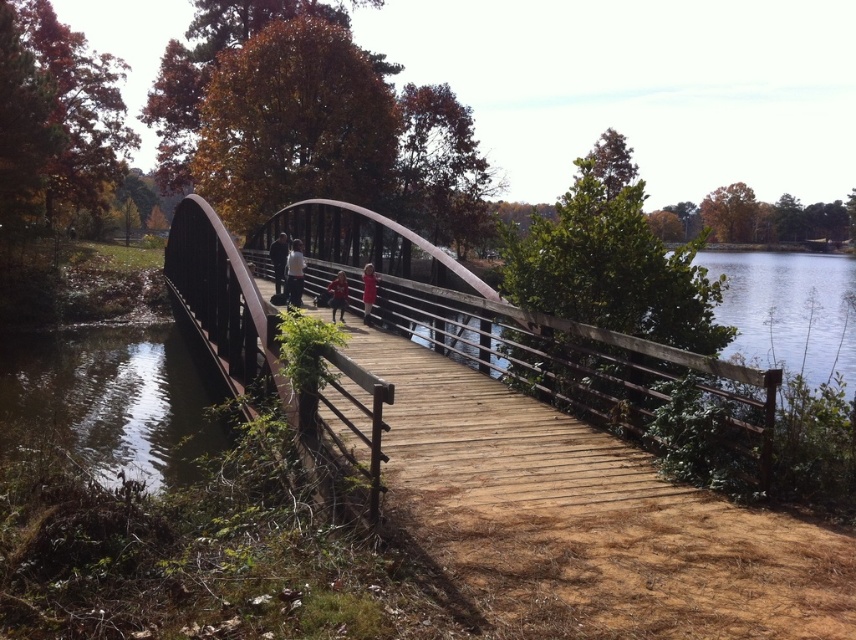
You are a hiker planning to cross the water body in the scene. You see both the wooden bridge at center and the rusty metal bridge at center. Which bridge should you choose if you want to cross to the other side?

The wooden bridge at center has a smaller size compared to rusty metal bridge at center. Since the wooden bridge is smaller, it might be less stable or have a narrower path. The rusty metal bridge at center is larger and likely more stable, so you should choose the rusty metal bridge at center to cross safely.

You are a hiker who wants to cross the water body in the scene. You see the wooden bridge at center and the rusty metal bridge at center. Which bridge is located below the other one?

The wooden bridge at center is positioned under the rusty metal bridge at center, so the wooden bridge is below the rusty metal bridge.